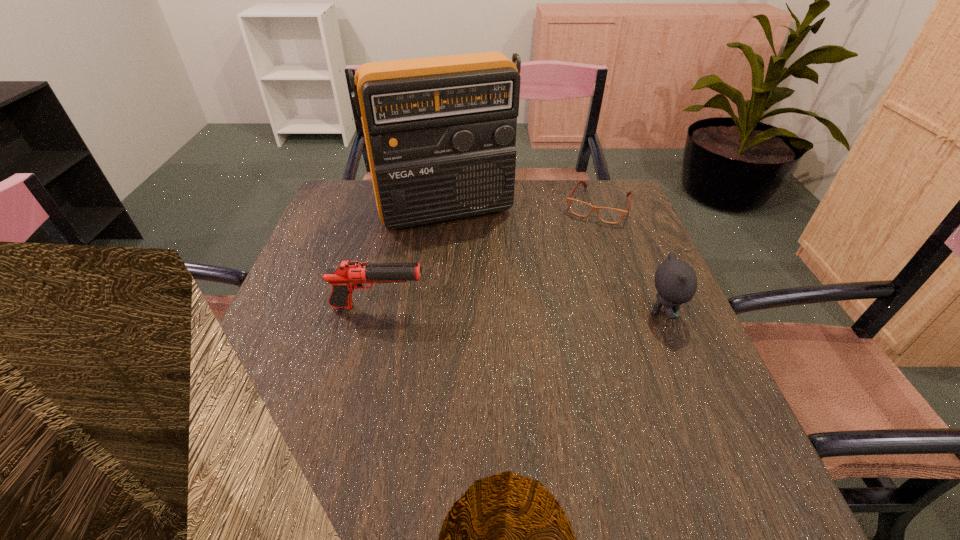
The width and height of the screenshot is (960, 540). I want to click on gun, so click(x=348, y=275).

Locate an element on the screen. The width and height of the screenshot is (960, 540). kitten is located at coordinates (675, 280).

Where is `the shortest object`? The height and width of the screenshot is (540, 960). the shortest object is located at coordinates (608, 215).

The image size is (960, 540). Identify the location of the tallest object. (440, 132).

Identify the location of vacant space located 0.270m at the aiming end of the gun. The height and width of the screenshot is (540, 960). (541, 307).

You are a GUI agent. You are given a task and a screenshot of the screen. Output one action in this format:
    pyautogui.click(x=<x>, y=<y>)
    Task: Click on the blank space located 0.180m on the front-facing side of the shortest object
    The width and height of the screenshot is (960, 540).
    Given the screenshot: What is the action you would take?
    [571, 261]

Find the location of `vacant space located 0.350m on the front-facing side of the shortest object`. vacant space located 0.350m on the front-facing side of the shortest object is located at coordinates (551, 304).

Where is `free space located on the front-facing side of the shortest object`? free space located on the front-facing side of the shortest object is located at coordinates (584, 236).

Identify the location of free space located 0.190m on the front-facing side of the radio receiver. This screenshot has height=540, width=960. (486, 279).

Where is `vacant region located on the front-facing side of the radio receiver`? The height and width of the screenshot is (540, 960). vacant region located on the front-facing side of the radio receiver is located at coordinates (486, 279).